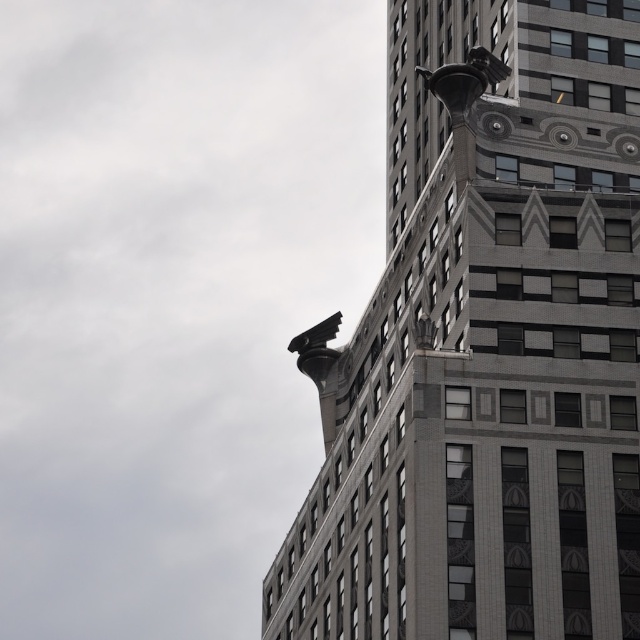
Question: Can you confirm if gray stone eagle at upper right is positioned to the left of dark gray stone gargoyle at upper center?

Choices:
 (A) no
 (B) yes

Answer: (B)

Question: Does gray stone eagle at upper right have a lesser width compared to dark gray stone gargoyle at upper center?

Choices:
 (A) yes
 (B) no

Answer: (B)

Question: Which point appears farthest from the camera in this image?

Choices:
 (A) (444, 106)
 (B) (572, 515)

Answer: (A)

Question: Which point is closer to the camera?

Choices:
 (A) (525, 371)
 (B) (458, 68)

Answer: (A)

Question: Is gray stone eagle at upper right to the right of dark gray stone gargoyle at upper center from the viewer's perspective?

Choices:
 (A) no
 (B) yes

Answer: (A)